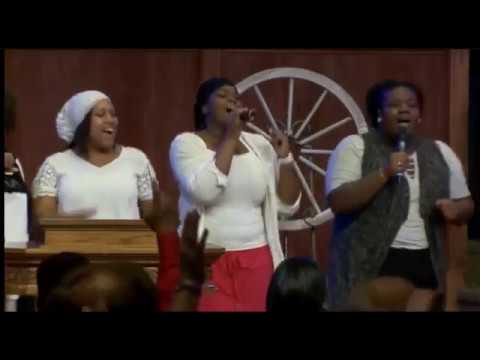
Where is `brown wall`? This screenshot has width=480, height=360. brown wall is located at coordinates (180, 94).